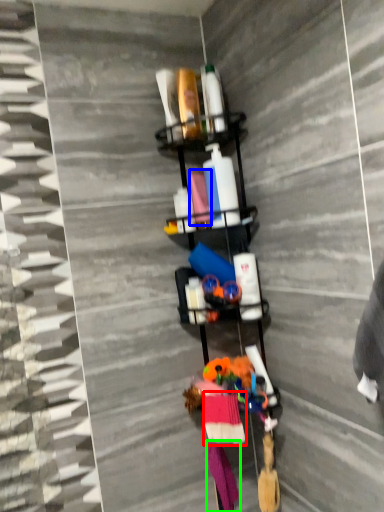
Question: Considering the real-world distances, which object is farthest from clothing (highlighted by a red box)? fabric (highlighted by a blue box) or clothing (highlighted by a green box)?

Choices:
 (A) fabric
 (B) clothing

Answer: (A)